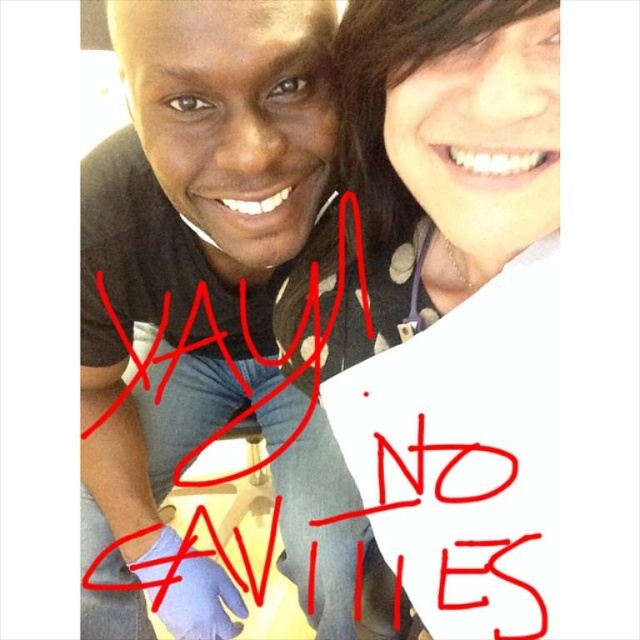
Image resolution: width=640 pixels, height=640 pixels. I want to click on matte black shirt at upper left, so click(192, 241).

Describe the element at coordinates (192, 241) in the screenshot. I see `matte black shirt at upper left` at that location.

Who is more distant from viewer, (x=196, y=141) or (x=486, y=164)?

The point (x=196, y=141) is behind.

You are a GUI agent. You are given a task and a screenshot of the screen. Output one action in this format:
    pyautogui.click(x=<x>, y=<y>)
    Task: Click on the matte black shirt at upper left
    This screenshot has height=640, width=640.
    Given the screenshot: What is the action you would take?
    pyautogui.click(x=192, y=241)